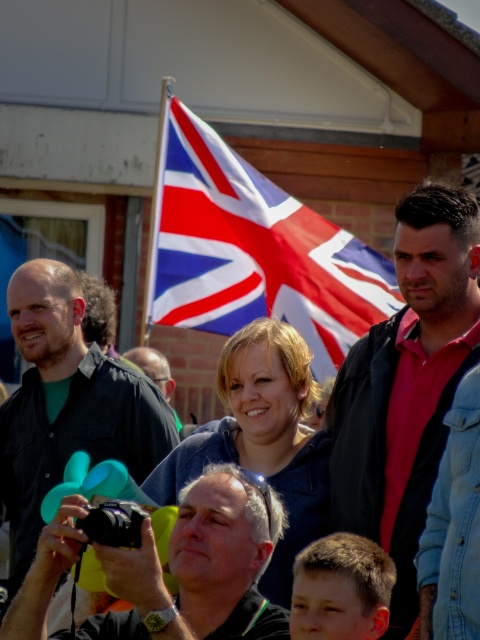
In the scene shown: Which of these two, red and white fabric flag at center or matte black camera at center, stands shorter?

Standing shorter between the two is matte black camera at center.

Does red and white fabric flag at center appear on the right side of matte black camera at center?

No, red and white fabric flag at center is not to the right of matte black camera at center.

Measure the distance between red and white fabric flag at center and camera.

A distance of 207.49 feet exists between red and white fabric flag at center and camera.

At what (x,y) coordinates should I click in order to perform the action: click on red and white fabric flag at center. Please return your answer as a coordinate pair (x, y). This screenshot has height=640, width=480. Looking at the image, I should click on (253, 250).

Is denim jacket at right bigger than red and white fabric flag at center?

Indeed, denim jacket at right has a larger size compared to red and white fabric flag at center.

Can you confirm if denim jacket at right is smaller than red and white fabric flag at center?

No.

Who is more forward, (434, 294) or (274, 228)?

Positioned in front is point (434, 294).

You are a GUI agent. You are given a task and a screenshot of the screen. Output one action in this format:
    pyautogui.click(x=<x>, y=<y>)
    Task: Click on the denim jacket at right
    This screenshot has height=640, width=480.
    Given the screenshot: What is the action you would take?
    pyautogui.click(x=407, y=385)

Which is more to the left, matte black shirt at left or matte black camera at center?

Positioned to the left is matte black shirt at left.

Is matte black shirt at left above matte black camera at center?

Yes, matte black shirt at left is above matte black camera at center.

The height and width of the screenshot is (640, 480). What do you see at coordinates (67, 403) in the screenshot?
I see `matte black shirt at left` at bounding box center [67, 403].

Locate an element on the screen. matte black shirt at left is located at coordinates (67, 403).